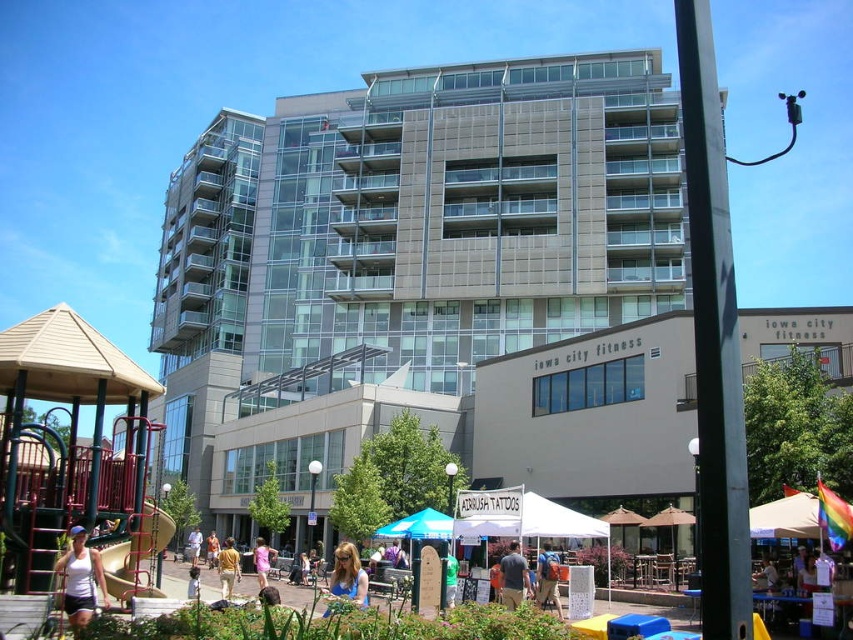
Who is positioned more to the right, blue denim jeans at center or green t-shirt at center?

blue denim jeans at center is more to the right.

Is blue denim jeans at center to the left of green t-shirt at center from the viewer's perspective?

No, blue denim jeans at center is not to the left of green t-shirt at center.

Where is `blue denim jeans at center`? blue denim jeans at center is located at coordinates (547, 579).

Image resolution: width=853 pixels, height=640 pixels. I want to click on blue denim jeans at center, so click(547, 579).

Can you confirm if matte white tank top at lower left is thinner than orange cotton shirt at center?

Yes, matte white tank top at lower left is thinner than orange cotton shirt at center.

Does matte white tank top at lower left come behind orange cotton shirt at center?

No, matte white tank top at lower left is in front of orange cotton shirt at center.

The height and width of the screenshot is (640, 853). Describe the element at coordinates (80, 579) in the screenshot. I see `matte white tank top at lower left` at that location.

This screenshot has height=640, width=853. Find the location of `matte white tank top at lower left`. matte white tank top at lower left is located at coordinates (80, 579).

Can you confirm if blue denim shirt at center is wider than tan cotton shirt at center?

No.

Who is shorter, blue denim shirt at center or tan cotton shirt at center?

blue denim shirt at center is shorter.

Which is behind, point (514, 596) or point (231, 548)?

The point (231, 548) is more distant.

Identify the location of blue denim shirt at center. (514, 577).